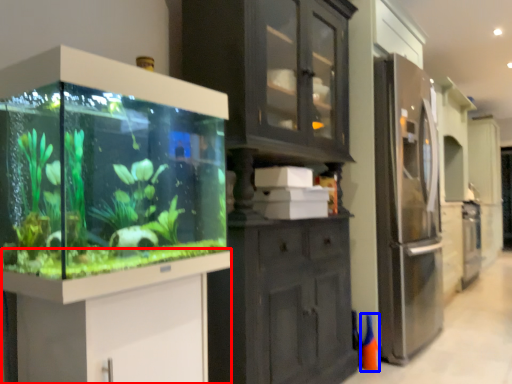
Question: Among these objects, which one is farthest to the camera, vanity (highlighted by a red box) or cone (highlighted by a blue box)?

Choices:
 (A) vanity
 (B) cone

Answer: (B)